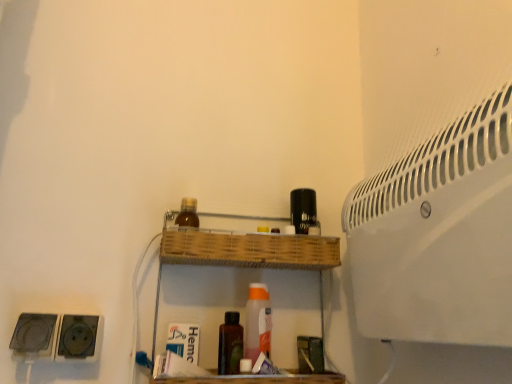
The width and height of the screenshot is (512, 384). What do you see at coordinates (439, 235) in the screenshot? I see `white plastic air conditioning unit at upper right` at bounding box center [439, 235].

The image size is (512, 384). What do you see at coordinates (34, 335) in the screenshot?
I see `black plastic speaker at lower left, acting as the first speaker starting from the left` at bounding box center [34, 335].

Locate an element on the screen. This screenshot has height=384, width=512. black plastic socket at lower left, the first speaker when ordered from right to left is located at coordinates (79, 338).

What is the approximate height of brown matte bottle at center, which is the first bottle in bottom-to-top order?

14.14 centimeters.

What do you see at coordinates (230, 344) in the screenshot? The image size is (512, 384). I see `brown matte bottle at center, which ranks as the 2th bottle in left-to-right order` at bounding box center [230, 344].

The height and width of the screenshot is (384, 512). Describe the element at coordinates (188, 214) in the screenshot. I see `brown glass bottle at upper center, arranged as the first bottle when viewed from the left` at that location.

Find the location of `wooden at center`. wooden at center is located at coordinates (245, 255).

Based on their positions, is brown matte bottle at center, the 2th bottle viewed from the top, located to the left or right of wooden at center?

In the image, brown matte bottle at center, the 2th bottle viewed from the top, appears on the left side of wooden at center.

Considering the relative sizes of brown matte bottle at center, arranged as the 1th bottle when viewed from the right, and wooden at center in the image provided, is brown matte bottle at center, arranged as the 1th bottle when viewed from the right, smaller than wooden at center?

Correct, brown matte bottle at center, arranged as the 1th bottle when viewed from the right, occupies less space than wooden at center.

Considering the sizes of objects brown matte bottle at center, which ranks as the 2th bottle in left-to-right order, and wooden at center in the image provided, who is thinner, brown matte bottle at center, which ranks as the 2th bottle in left-to-right order, or wooden at center?

Thinner between the two is brown matte bottle at center, which ranks as the 2th bottle in left-to-right order.

Is brown matte bottle at center, arranged as the 1th bottle when viewed from the right, next to wooden at center?

brown matte bottle at center, arranged as the 1th bottle when viewed from the right, and wooden at center are clearly separated.

Is black plastic speaker at lower left, which is the 2th speaker in right-to-left order, positioned with its back to white plastic air conditioning unit at upper right?

No, white plastic air conditioning unit at upper right is not at the back of black plastic speaker at lower left, which is the 2th speaker in right-to-left order.

Are black plastic speaker at lower left, which is the 2th speaker in right-to-left order, and white plastic air conditioning unit at upper right making contact?

No, black plastic speaker at lower left, which is the 2th speaker in right-to-left order, is not next to white plastic air conditioning unit at upper right.

Is black plastic speaker at lower left, which is the 2th speaker in right-to-left order, situated inside white plastic air conditioning unit at upper right or outside?

black plastic speaker at lower left, which is the 2th speaker in right-to-left order, is located beyond the bounds of white plastic air conditioning unit at upper right.

Between black plastic speaker at lower left, acting as the first speaker starting from the left, and white plastic air conditioning unit at upper right, which one is positioned behind?

black plastic speaker at lower left, acting as the first speaker starting from the left, is further away from the camera.

Is black plastic socket at lower left, marked as the 2th speaker in a left-to-right arrangement, facing towards white plastic air conditioning unit at upper right?

No.

What's the angular difference between black plastic socket at lower left, marked as the 2th speaker in a left-to-right arrangement, and white plastic air conditioning unit at upper right's facing directions?

There is a 89.2-degree angle between the facing directions of black plastic socket at lower left, marked as the 2th speaker in a left-to-right arrangement, and white plastic air conditioning unit at upper right.

Considering the relative positions of black plastic socket at lower left, the first speaker when ordered from right to left, and white plastic air conditioning unit at upper right in the image provided, is black plastic socket at lower left, the first speaker when ordered from right to left, to the left of white plastic air conditioning unit at upper right from the viewer's perspective?

Correct, you'll find black plastic socket at lower left, the first speaker when ordered from right to left, to the left of white plastic air conditioning unit at upper right.

From the image's perspective, which one is positioned lower, black plastic socket at lower left, marked as the 2th speaker in a left-to-right arrangement, or white plastic air conditioning unit at upper right?

black plastic socket at lower left, marked as the 2th speaker in a left-to-right arrangement, from the image's perspective.

What's the angular difference between brown glass bottle at upper center, arranged as the first bottle when viewed from the left, and black plastic socket at lower left, the first speaker when ordered from right to left,'s facing directions?

There is a 1.1-degree angle between the facing directions of brown glass bottle at upper center, arranged as the first bottle when viewed from the left, and black plastic socket at lower left, the first speaker when ordered from right to left.

From the image's perspective, is brown glass bottle at upper center, which ranks as the 2th bottle in right-to-left order, above or below black plastic socket at lower left, marked as the 2th speaker in a left-to-right arrangement?

brown glass bottle at upper center, which ranks as the 2th bottle in right-to-left order, is situated higher than black plastic socket at lower left, marked as the 2th speaker in a left-to-right arrangement, in the image.

Is brown glass bottle at upper center, which ranks as the 2th bottle in right-to-left order, shorter than black plastic socket at lower left, the first speaker when ordered from right to left?

Yes.

From a real-world perspective, is brown glass bottle at upper center, the first bottle viewed from the top, under black plastic socket at lower left, marked as the 2th speaker in a left-to-right arrangement?

No, from a real-world perspective, brown glass bottle at upper center, the first bottle viewed from the top, is not below black plastic socket at lower left, marked as the 2th speaker in a left-to-right arrangement.

Is point (36, 350) closer to viewer compared to point (68, 317)?

Yes, it is.

Is black plastic speaker at lower left, acting as the first speaker starting from the left, bigger than black plastic socket at lower left, the first speaker when ordered from right to left?

Correct, black plastic speaker at lower left, acting as the first speaker starting from the left, is larger in size than black plastic socket at lower left, the first speaker when ordered from right to left.

Which is behind, black plastic speaker at lower left, acting as the first speaker starting from the left, or black plastic socket at lower left, the first speaker when ordered from right to left?

black plastic socket at lower left, the first speaker when ordered from right to left.

Locate an element on the screen. The height and width of the screenshot is (384, 512). speaker positioned vertically above the black plastic socket at lower left, the first speaker when ordered from right to left (from a real-world perspective) is located at coordinates (34, 335).

Considering the positions of point (48, 350) and point (223, 344), is point (48, 350) closer or farther from the camera than point (223, 344)?

Point (48, 350) appears to be closer to the viewer than point (223, 344).

Looking at the image, does black plastic speaker at lower left, acting as the first speaker starting from the left, seem bigger or smaller compared to brown matte bottle at center, which is the first bottle in bottom-to-top order?

black plastic speaker at lower left, acting as the first speaker starting from the left, is smaller than brown matte bottle at center, which is the first bottle in bottom-to-top order.

Does black plastic speaker at lower left, which is the 2th speaker in right-to-left order, have a lesser height compared to brown matte bottle at center, which is the first bottle in bottom-to-top order?

Yes.

Can you confirm if black plastic speaker at lower left, which is the 2th speaker in right-to-left order, is positioned to the right of brown matte bottle at center, the 2th bottle viewed from the top?

In fact, black plastic speaker at lower left, which is the 2th speaker in right-to-left order, is to the left of brown matte bottle at center, the 2th bottle viewed from the top.

Considering the relative sizes of white plastic air conditioning unit at upper right and black plastic socket at lower left, the first speaker when ordered from right to left, in the image provided, is white plastic air conditioning unit at upper right shorter than black plastic socket at lower left, the first speaker when ordered from right to left,?

In fact, white plastic air conditioning unit at upper right may be taller than black plastic socket at lower left, the first speaker when ordered from right to left.

From a real-world perspective, is white plastic air conditioning unit at upper right on top of black plastic socket at lower left, the first speaker when ordered from right to left?

Correct, in the physical world, white plastic air conditioning unit at upper right is higher than black plastic socket at lower left, the first speaker when ordered from right to left.

Is there a large distance between white plastic air conditioning unit at upper right and black plastic socket at lower left, marked as the 2th speaker in a left-to-right arrangement?

That's not correct — white plastic air conditioning unit at upper right is a little close to black plastic socket at lower left, marked as the 2th speaker in a left-to-right arrangement.

Is white plastic air conditioning unit at upper right oriented away from black plastic socket at lower left, marked as the 2th speaker in a left-to-right arrangement?

No, white plastic air conditioning unit at upper right is not facing away from black plastic socket at lower left, marked as the 2th speaker in a left-to-right arrangement.

The image size is (512, 384). I want to click on shelf in front of the brown matte bottle at center, which is the first bottle in bottom-to-top order, so click(x=245, y=255).

From a real-world perspective, starting from the white plastic air conditioning unit at upper right, which speaker is the 1st one below it? Please provide its 2D coordinates.

[(34, 335)]

From the image, which object appears to be farther from wooden at center, brown matte bottle at center, arranged as the 1th bottle when viewed from the right, or white plastic air conditioning unit at upper right?

The object further to wooden at center is white plastic air conditioning unit at upper right.

Looking at the image, which one is located closer to brown matte bottle at center, which ranks as the 2th bottle in left-to-right order, white plastic air conditioning unit at upper right or brown glass bottle at upper center, which ranks as the 2th bottle in right-to-left order?

brown glass bottle at upper center, which ranks as the 2th bottle in right-to-left order, is positioned closer to the anchor brown matte bottle at center, which ranks as the 2th bottle in left-to-right order.

Based on their spatial positions, is brown glass bottle at upper center, the first bottle viewed from the top, or wooden at center closer to white plastic air conditioning unit at upper right?

Among the two, wooden at center is located nearer to white plastic air conditioning unit at upper right.

Estimate the real-world distances between objects in this image. Which object is further from brown glass bottle at upper center, arranged as the first bottle when viewed from the left, black plastic speaker at lower left, acting as the first speaker starting from the left, or brown matte bottle at center, the 2th bottle viewed from the top?

Among the two, black plastic speaker at lower left, acting as the first speaker starting from the left, is located further to brown glass bottle at upper center, arranged as the first bottle when viewed from the left.

From the image, which object appears to be farther from white plastic air conditioning unit at upper right, wooden at center or brown matte bottle at center, the 2th bottle viewed from the top?

brown matte bottle at center, the 2th bottle viewed from the top.

When comparing their distances from brown glass bottle at upper center, the first bottle viewed from the top, does brown matte bottle at center, the 2th bottle viewed from the top, or black plastic socket at lower left, marked as the 2th speaker in a left-to-right arrangement, seem further?

Among the two, black plastic socket at lower left, marked as the 2th speaker in a left-to-right arrangement, is located further to brown glass bottle at upper center, the first bottle viewed from the top.

Looking at this image, from the image, which object appears to be nearer to black plastic socket at lower left, marked as the 2th speaker in a left-to-right arrangement, brown glass bottle at upper center, the first bottle viewed from the top, or brown matte bottle at center, the 2th bottle viewed from the top?

brown matte bottle at center, the 2th bottle viewed from the top.

Based on their spatial positions, is brown glass bottle at upper center, the first bottle viewed from the top, or white plastic air conditioning unit at upper right closer to brown matte bottle at center, which ranks as the 2th bottle in left-to-right order?

Based on the image, brown glass bottle at upper center, the first bottle viewed from the top, appears to be nearer to brown matte bottle at center, which ranks as the 2th bottle in left-to-right order.

This screenshot has height=384, width=512. What are the coordinates of `shelf between black plastic socket at lower left, the first speaker when ordered from right to left, and white plastic air conditioning unit at upper right` in the screenshot? It's located at (245, 255).

I want to click on bottle between black plastic socket at lower left, marked as the 2th speaker in a left-to-right arrangement, and brown matte bottle at center, which is the first bottle in bottom-to-top order, from left to right, so click(x=188, y=214).

Where is `speaker located between black plastic speaker at lower left, acting as the first speaker starting from the left, and brown glass bottle at upper center, arranged as the first bottle when viewed from the left, in the left-right direction`? This screenshot has width=512, height=384. speaker located between black plastic speaker at lower left, acting as the first speaker starting from the left, and brown glass bottle at upper center, arranged as the first bottle when viewed from the left, in the left-right direction is located at coordinates (79, 338).

Find the location of a particular element. Image resolution: width=512 pixels, height=384 pixels. speaker situated between black plastic speaker at lower left, which is the 2th speaker in right-to-left order, and wooden at center from left to right is located at coordinates (79, 338).